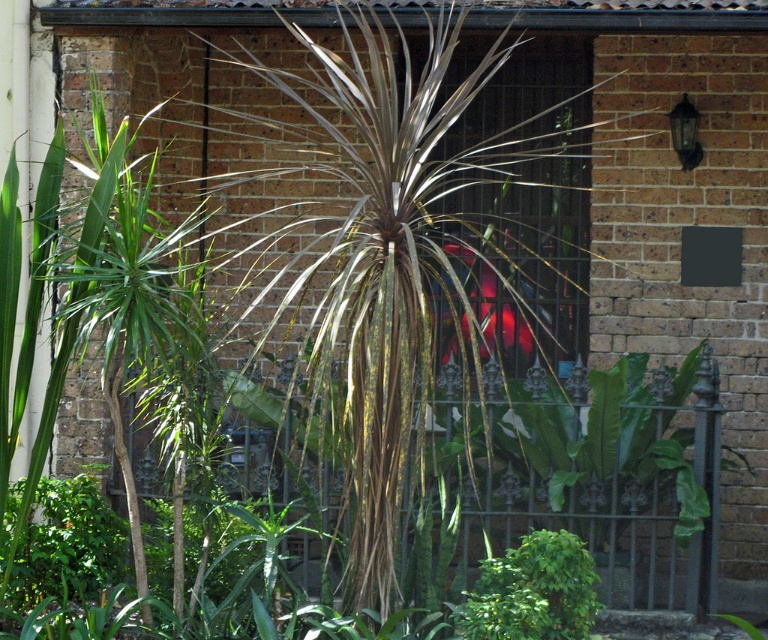
You are a gardener who needs to place a new statue that is 1.2 meters tall between the silvery textured palm tree at center and the green leafy bush at lower center. Based on their heights, will the statue be visible from the front of the garden?

The silvery textured palm tree at center is taller than the green leafy bush at lower center. Since the statue is 1.2 meters tall, it will be visible from the front of the garden as long as it is placed between them, provided it is not obscured by the taller palm tree.

You are a gardener who needs to move a 2 meter wide decorative stone between the silvery textured palm tree at center and the green leafy bush at lower center. Can the stone fit between them without touching either plant?

The silvery textured palm tree at center and green leafy bush at lower center are 2.18 meters apart, so the 2 meter wide decorative stone can fit between them without touching either plant since the distance is greater than the stone width.